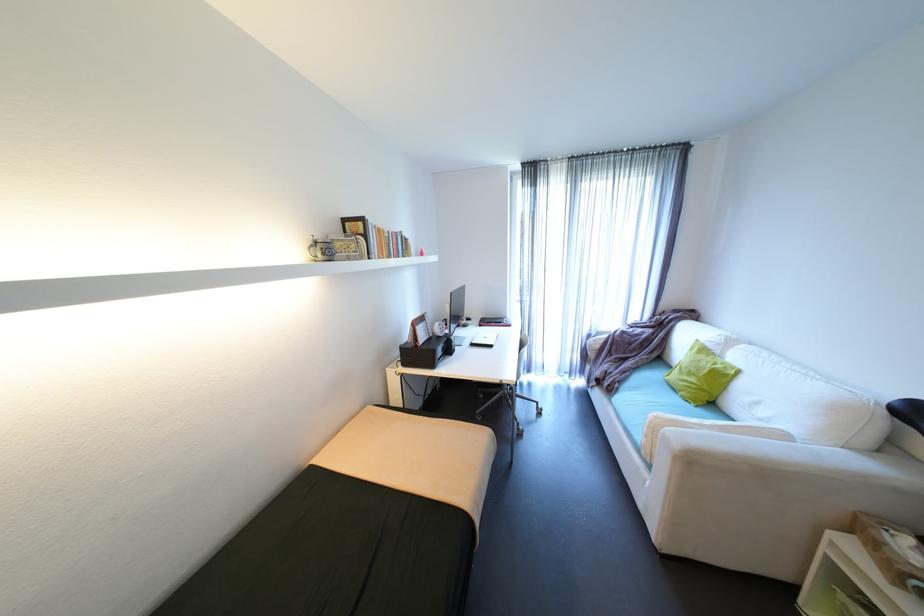
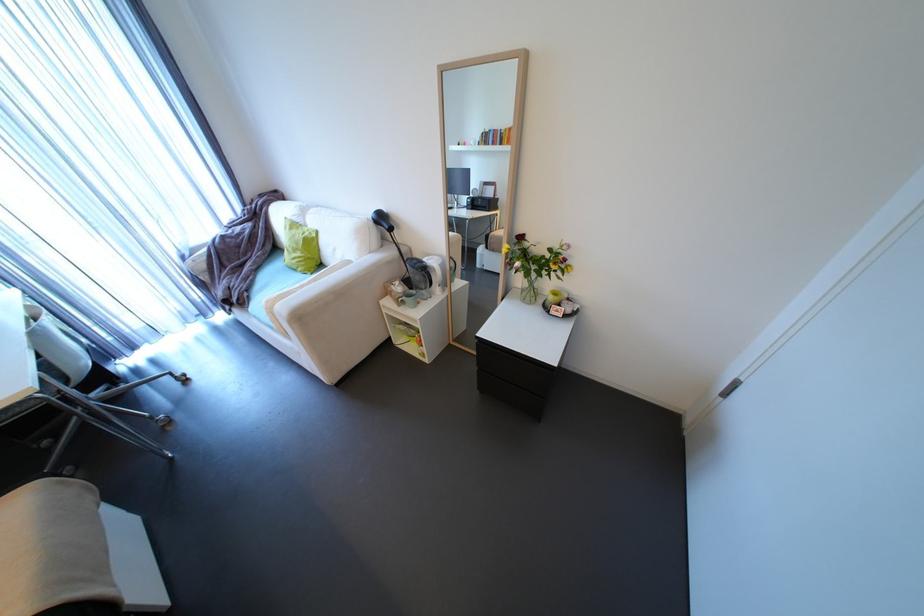
In the second image, find the point that corresponds to point 703,407 in the first image.

(319, 274)